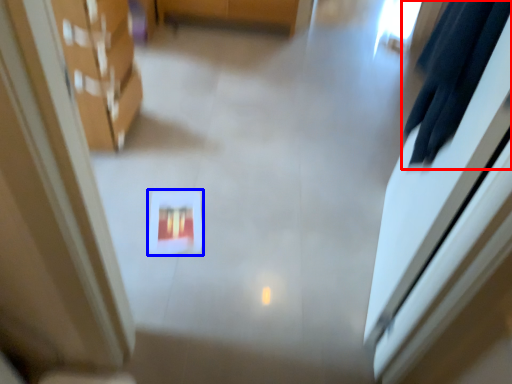
Question: Which point is further to the camera, robe (highlighted by a red box) or square (highlighted by a blue box)?

Choices:
 (A) robe
 (B) square

Answer: (B)